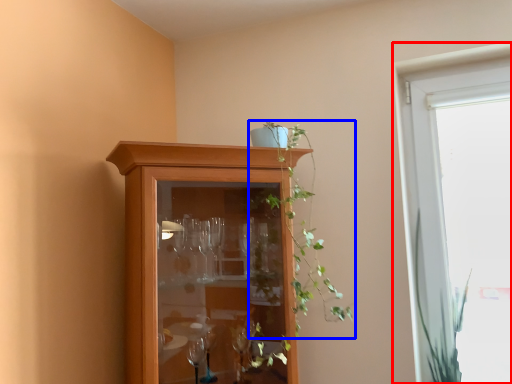
Question: Among these objects, which one is farthest to the camera, window (highlighted by a red box) or houseplant (highlighted by a blue box)?

Choices:
 (A) window
 (B) houseplant

Answer: (A)